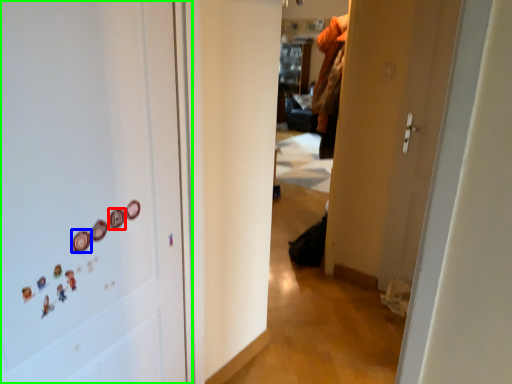
Question: Which object is positioned closest to button (highlighted by a red box)? Select from button (highlighted by a blue box) and door (highlighted by a green box).

Choices:
 (A) button
 (B) door

Answer: (A)